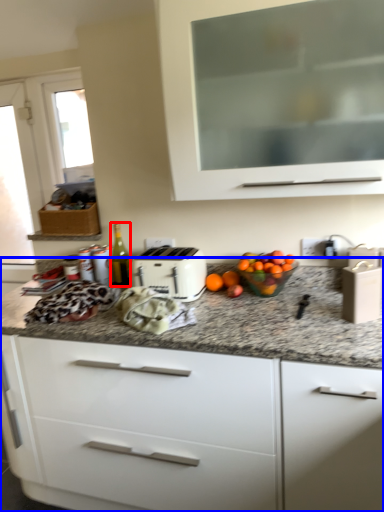
Question: Which object is closer to the camera taking this photo, bottle (highlighted by a red box) or cabinetry (highlighted by a blue box)?

Choices:
 (A) bottle
 (B) cabinetry

Answer: (B)